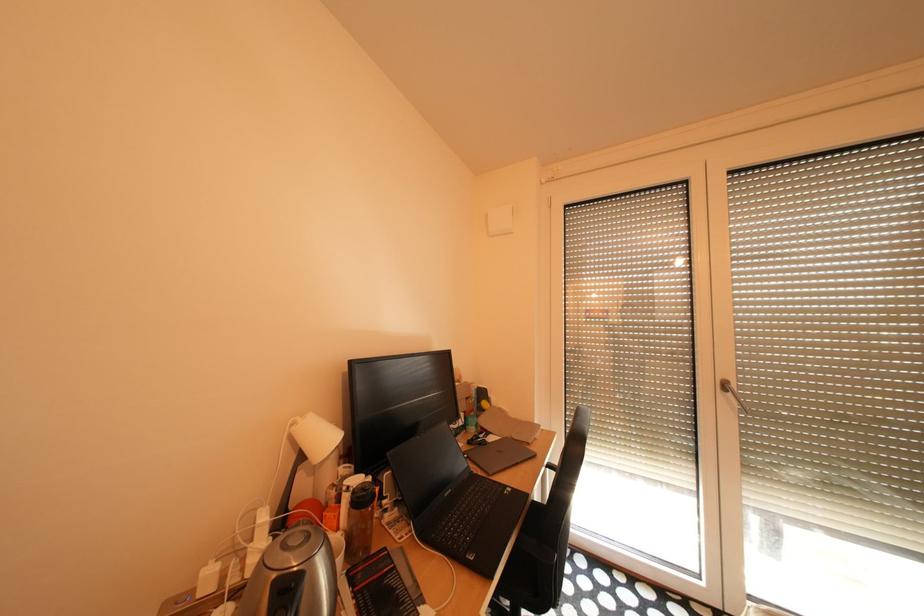
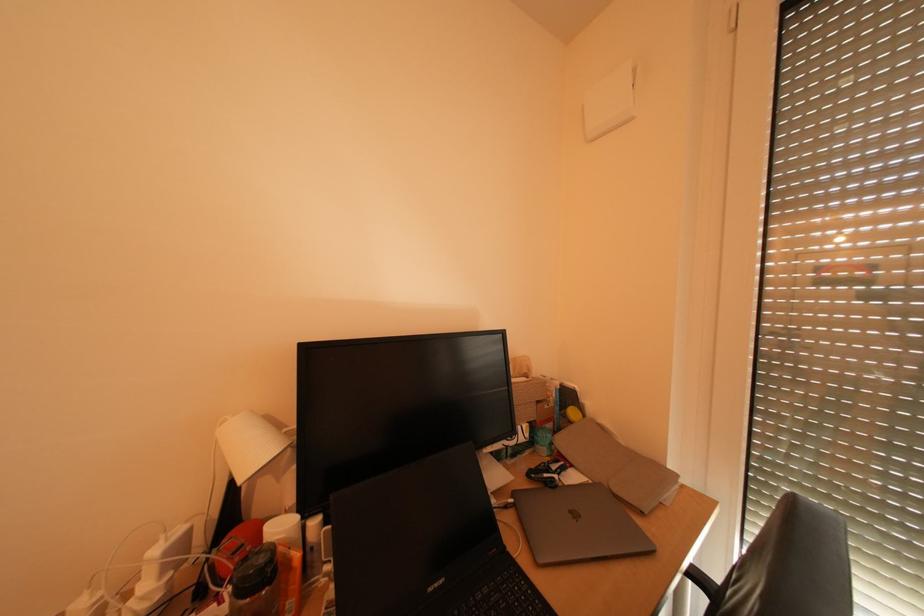
Question: The images are taken continuously from a first-person perspective. In which direction is your viewpoint rotating?

Choices:
 (A) Left
 (B) Right
 (C) Up
 (D) Down

Answer: (A)